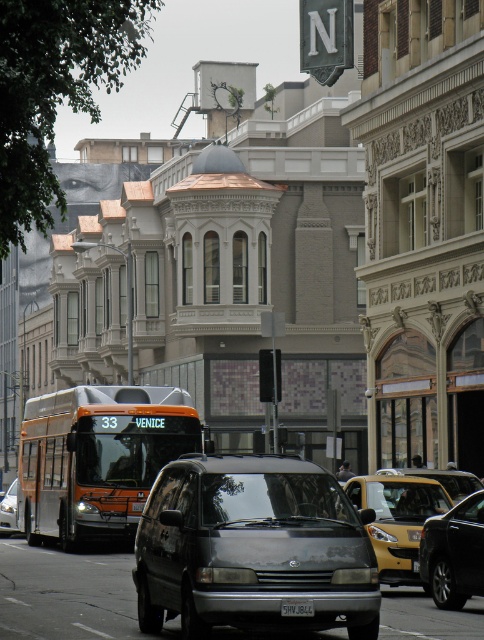
Question: Which object is the farthest from the metallic silver van at center?

Choices:
 (A) white plastic license plate at center
 (B) shiny black sedan at center
 (C) orange metallic bus at center
 (D) metallic gray van at center

Answer: (A)

Question: Does yellow metallic taxi at center appear under white plastic license plate at center?

Choices:
 (A) no
 (B) yes

Answer: (B)

Question: Is shiny black sedan at center below metallic silver van at center?

Choices:
 (A) no
 (B) yes

Answer: (A)

Question: Which point appears closest to the camera in this image?

Choices:
 (A) (289, 612)
 (B) (4, 532)

Answer: (A)

Question: Can you confirm if orange metallic bus at center is positioned above white plastic license plate at center?

Choices:
 (A) yes
 (B) no

Answer: (A)

Question: Among these points, which one is farthest from the camera?

Choices:
 (A) (11, 504)
 (B) (442, 524)
 (C) (366, 618)

Answer: (A)